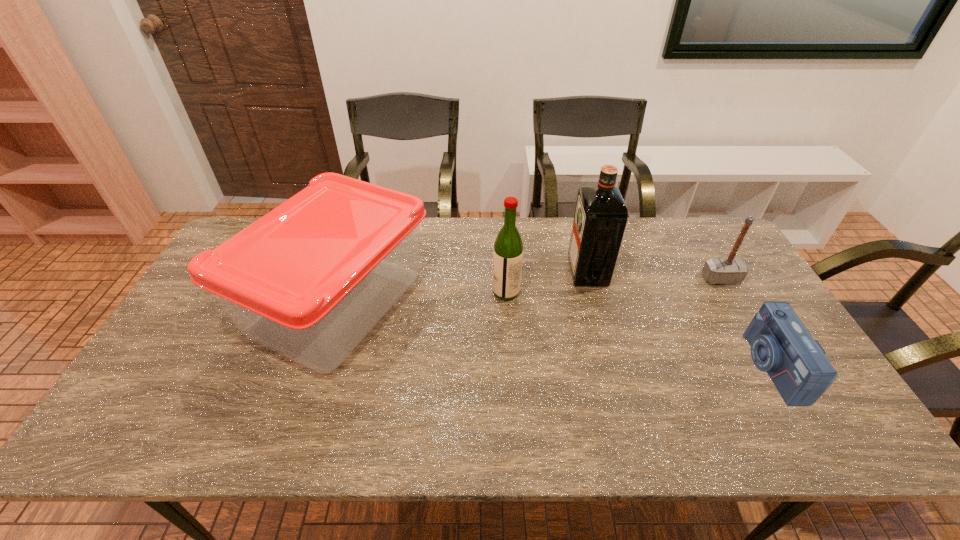
Where is `the third object from right to left`? The width and height of the screenshot is (960, 540). the third object from right to left is located at coordinates (601, 215).

In order to click on the left liquor in this screenshot , I will do `click(508, 248)`.

This screenshot has height=540, width=960. Identify the location of tray. (310, 279).

Locate an element on the screen. the second shortest object is located at coordinates (730, 270).

At what (x,y) coordinates should I click in order to perform the action: click on the shortest object. Please return your answer as a coordinate pair (x, y). Looking at the image, I should click on (781, 345).

The height and width of the screenshot is (540, 960). In order to click on vacant area situated 0.160m on the front label of the right liquor in this screenshot , I will do `click(519, 272)`.

Locate an element on the screen. vacant space situated on the front label of the right liquor is located at coordinates (501, 272).

Locate an element on the screen. vacant space located on the front label of the right liquor is located at coordinates (472, 272).

Identify the location of vacant space located 0.160m on the label of the left liquor. (440, 292).

At what (x,y) coordinates should I click in order to perform the action: click on free location located 0.370m on the label of the left liquor. Please return your answer as a coordinate pair (x, y). Looking at the image, I should click on (370, 292).